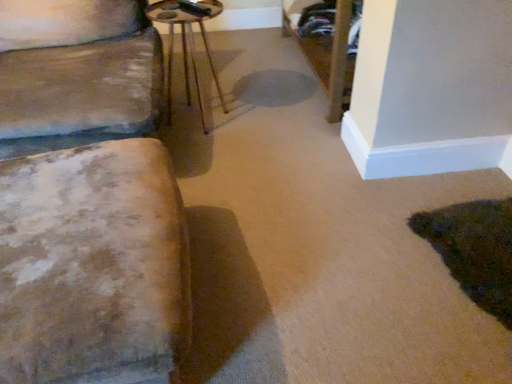
Question: Considering their positions, is distressed fabric ottoman at left located in front of or behind metallic brown side table at center?

Choices:
 (A) front
 (B) behind

Answer: (A)

Question: Is distressed fabric ottoman at left spatially inside metallic brown side table at center, or outside of it?

Choices:
 (A) outside
 (B) inside

Answer: (A)

Question: Is point (91, 349) positioned closer to the camera than point (202, 36)?

Choices:
 (A) closer
 (B) farther

Answer: (A)

Question: Is metallic brown side table at center wider or thinner than distressed fabric ottoman at left?

Choices:
 (A) thin
 (B) wide

Answer: (A)

Question: Would you say metallic brown side table at center is to the left or to the right of distressed fabric ottoman at left in the picture?

Choices:
 (A) right
 (B) left

Answer: (A)

Question: From their relative heights in the image, would you say metallic brown side table at center is taller or shorter than distressed fabric ottoman at left?

Choices:
 (A) short
 (B) tall

Answer: (B)

Question: Relative to distressed fabric ottoman at left, is metallic brown side table at center in front or behind?

Choices:
 (A) front
 (B) behind

Answer: (B)